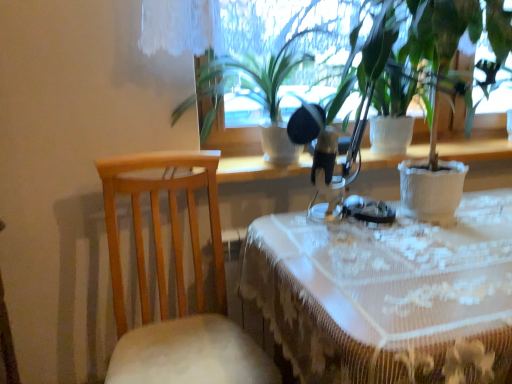
Question: Is white textured pot at center, marked as the second houseplant in a left-to-right arrangement, to the left of white lace tablecloth at center from the viewer's perspective?

Choices:
 (A) no
 (B) yes

Answer: (B)

Question: Considering the relative sizes of white textured pot at center, marked as the second houseplant in a left-to-right arrangement, and white lace tablecloth at center in the image provided, is white textured pot at center, marked as the second houseplant in a left-to-right arrangement, shorter than white lace tablecloth at center?

Choices:
 (A) yes
 (B) no

Answer: (A)

Question: Could you tell me if white textured pot at center, placed as the first houseplant when sorted from right to left, is facing white lace tablecloth at center?

Choices:
 (A) no
 (B) yes

Answer: (A)

Question: From a real-world perspective, is white textured pot at center, placed as the first houseplant when sorted from right to left, beneath white lace tablecloth at center?

Choices:
 (A) no
 (B) yes

Answer: (A)

Question: From a real-world perspective, is white textured pot at center, placed as the first houseplant when sorted from right to left, over white lace tablecloth at center?

Choices:
 (A) no
 (B) yes

Answer: (B)

Question: Is white textured pot at center, placed as the first houseplant when sorted from right to left, closer to the viewer compared to white lace tablecloth at center?

Choices:
 (A) no
 (B) yes

Answer: (A)

Question: Are white lace tablecloth at center and white textured pot at center, placed as the first houseplant when sorted from right to left, located far from each other?

Choices:
 (A) yes
 (B) no

Answer: (B)

Question: Is white lace tablecloth at center at the left side of white textured pot at center, placed as the first houseplant when sorted from right to left?

Choices:
 (A) yes
 (B) no

Answer: (B)

Question: From a real-world perspective, is white lace tablecloth at center positioned under white textured pot at center, marked as the second houseplant in a left-to-right arrangement, based on gravity?

Choices:
 (A) no
 (B) yes

Answer: (B)

Question: Is white lace tablecloth at center shorter than white textured pot at center, marked as the second houseplant in a left-to-right arrangement?

Choices:
 (A) yes
 (B) no

Answer: (B)

Question: Does white lace tablecloth at center have a greater width compared to white textured pot at center, marked as the second houseplant in a left-to-right arrangement?

Choices:
 (A) yes
 (B) no

Answer: (A)

Question: From the image's perspective, is white lace tablecloth at center beneath white textured pot at center, placed as the first houseplant when sorted from right to left?

Choices:
 (A) no
 (B) yes

Answer: (B)

Question: Is white lace tablecloth at center oriented away from light wood chair at left?

Choices:
 (A) yes
 (B) no

Answer: (B)